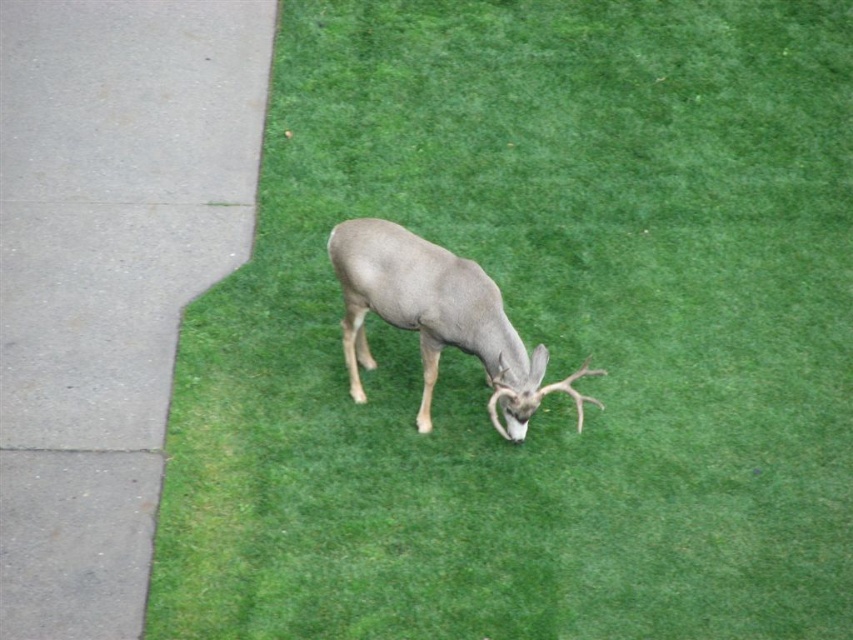
Is gray concrete pavement at left closer to the viewer compared to gray matte deer at center?

Yes, it is.

Who is lower down, gray concrete pavement at left or gray matte deer at center?

Positioned lower is gray matte deer at center.

Which is behind, point (109, 211) or point (440, 336)?

The point (109, 211) is more distant.

Locate an element on the screen. The width and height of the screenshot is (853, 640). gray concrete pavement at left is located at coordinates (108, 275).